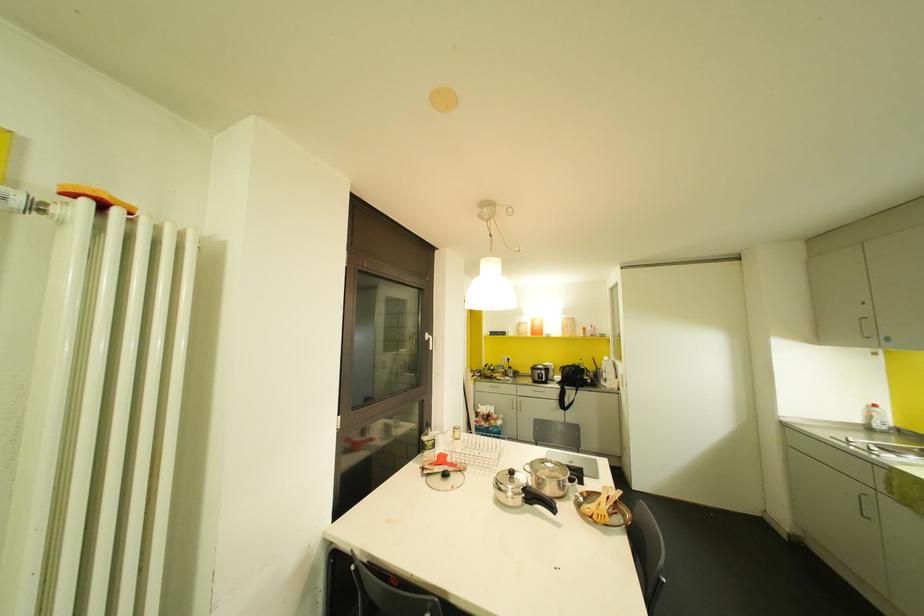
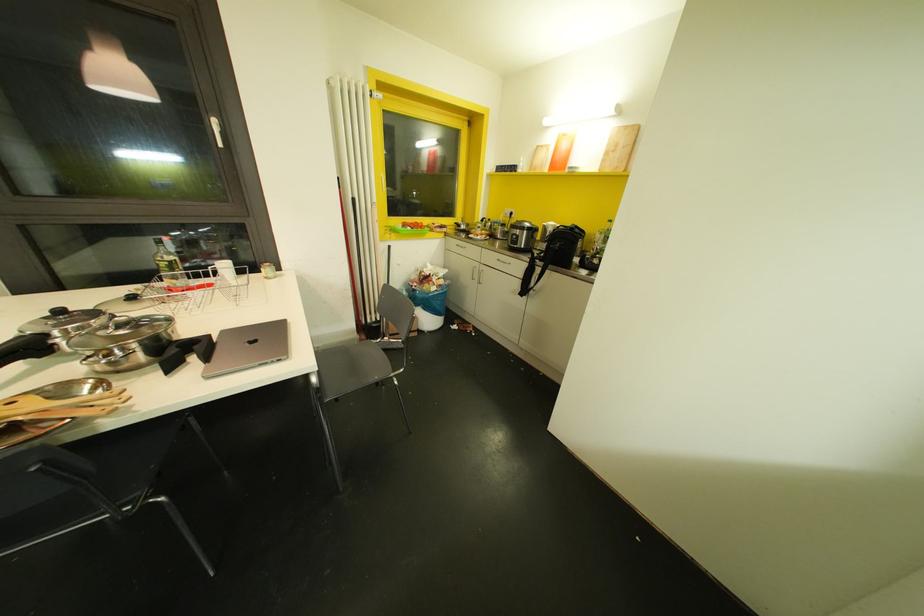
Question: I am providing you with two images of the same scene from different viewpoints. Please identify which objects are invisible in image2.

Choices:
 (A) chair sitting surface
 (B) wooden chopping board
 (C) cabinet drawer handle
 (D) none of these

Answer: (D)